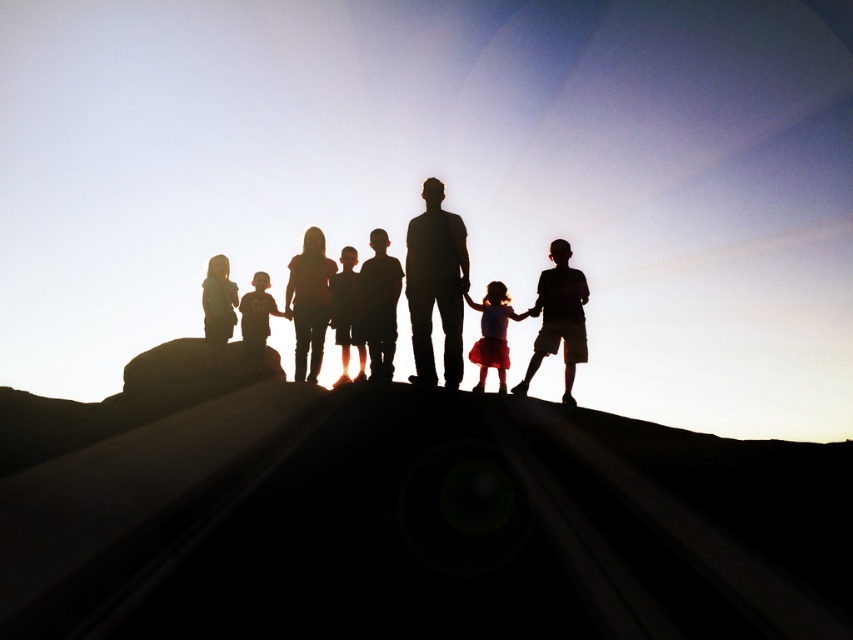
Question: Does matte black girl at center come in front of smooth black shirt at center?

Choices:
 (A) no
 (B) yes

Answer: (B)

Question: Can you confirm if silhouette family at center is positioned to the right of matte black child at center?

Choices:
 (A) yes
 (B) no

Answer: (A)

Question: Which of the following is the closest to the observer?

Choices:
 (A) silhouette child at center
 (B) matte black girl at center

Answer: (B)

Question: Which point is farther to the camera?

Choices:
 (A) matte black shirt at center
 (B) smooth black shirt at center

Answer: (A)

Question: Does silhouette family at center appear on the right side of silhouette child at center?

Choices:
 (A) yes
 (B) no

Answer: (A)

Question: Which object is closer to the camera taking this photo?

Choices:
 (A) smooth black shirt at center
 (B) matte black child at center

Answer: (B)